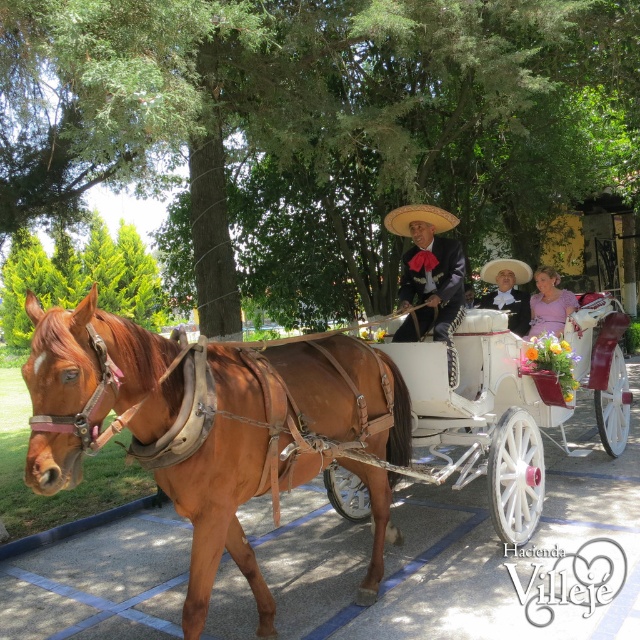
Which is in front, point (538, 321) or point (496, 273)?

Point (538, 321) is in front.

Does point (538, 301) come behind point (509, 262)?

Yes, point (538, 301) is behind point (509, 262).

At what (x,y) coordinates should I click in order to perform the action: click on pink satin dress at center. Please return your answer as a coordinate pair (x, y). This screenshot has height=640, width=640. Looking at the image, I should click on (548, 304).

Who is taller, brown leather horse at left or natural straw sombrero at center?

brown leather horse at left is taller.

Who is positioned more to the right, brown leather horse at left or natural straw sombrero at center?

natural straw sombrero at center

Where is `brown leather horse at left`? Image resolution: width=640 pixels, height=640 pixels. brown leather horse at left is located at coordinates (268, 449).

Does brown leather horse at left have a greater width compared to matte black suit at center?

Yes, brown leather horse at left is wider than matte black suit at center.

Who is positioned more to the right, brown leather horse at left or matte black suit at center?

matte black suit at center

The image size is (640, 640). In order to click on brown leather horse at left in this screenshot , I will do `click(268, 449)`.

At what (x,y) coordinates should I click in order to perform the action: click on brown leather horse at left. Please return your answer as a coordinate pair (x, y). This screenshot has width=640, height=640. Looking at the image, I should click on (268, 449).